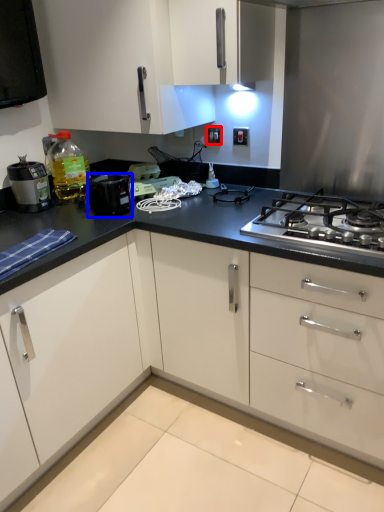
Question: Which point is closer to the camera, electric outlet (highlighted by a red box) or kitchen appliance (highlighted by a blue box)?

Choices:
 (A) electric outlet
 (B) kitchen appliance

Answer: (B)